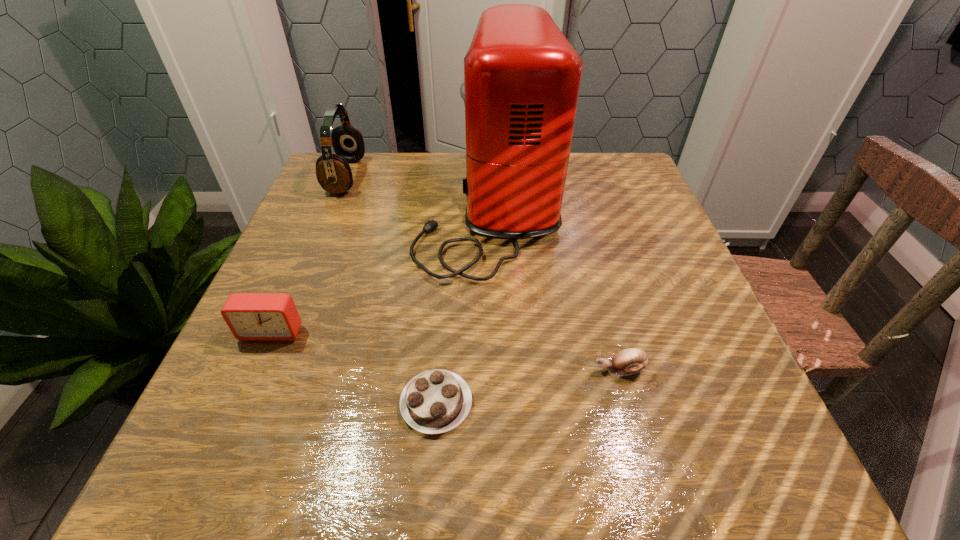
Identify the location of vacant space located on the front-facing side of the second shortest object. (543, 370).

Where is `blank space located 0.230m on the front-facing side of the second shortest object`? blank space located 0.230m on the front-facing side of the second shortest object is located at coordinates (450, 370).

The width and height of the screenshot is (960, 540). I want to click on free spot located on the front-facing side of the second shortest object, so click(550, 370).

Image resolution: width=960 pixels, height=540 pixels. In order to click on blank space located 0.090m on the back of the shortest object in this screenshot , I will do `click(443, 329)`.

You are a GUI agent. You are given a task and a screenshot of the screen. Output one action in this format:
    pyautogui.click(x=<x>, y=<y>)
    Task: Click on the kitchen mixer that is positioned at the far edge
    
    Given the screenshot: What is the action you would take?
    pyautogui.click(x=522, y=77)

At what (x,y) coordinates should I click in order to perform the action: click on headset situated at the far edge. Please return your answer as a coordinate pair (x, y). Looking at the image, I should click on (333, 172).

Identify the location of object that is at the near edge. (436, 401).

At what (x,y) coordinates should I click in order to perform the action: click on headset that is positioned at the left edge. Please return your answer as a coordinate pair (x, y). The width and height of the screenshot is (960, 540). Looking at the image, I should click on (333, 172).

This screenshot has width=960, height=540. In order to click on alarm clock present at the left edge in this screenshot , I will do `click(250, 316)`.

The height and width of the screenshot is (540, 960). Find the location of `object located in the right edge section of the desktop`. object located in the right edge section of the desktop is located at coordinates (630, 361).